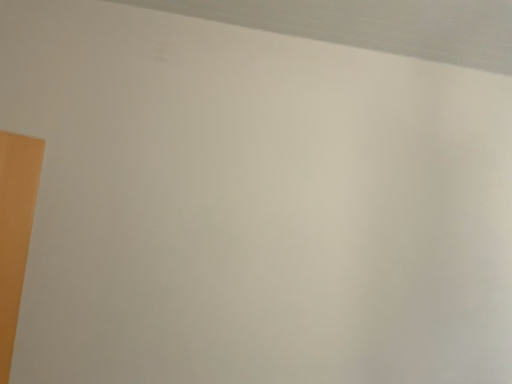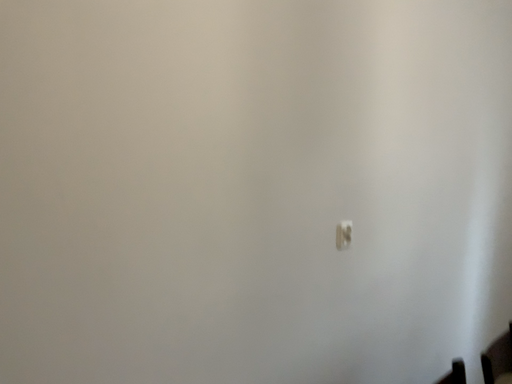
Question: Which way did the camera rotate in the video?

Choices:
 (A) rotated upward
 (B) rotated downward

Answer: (B)